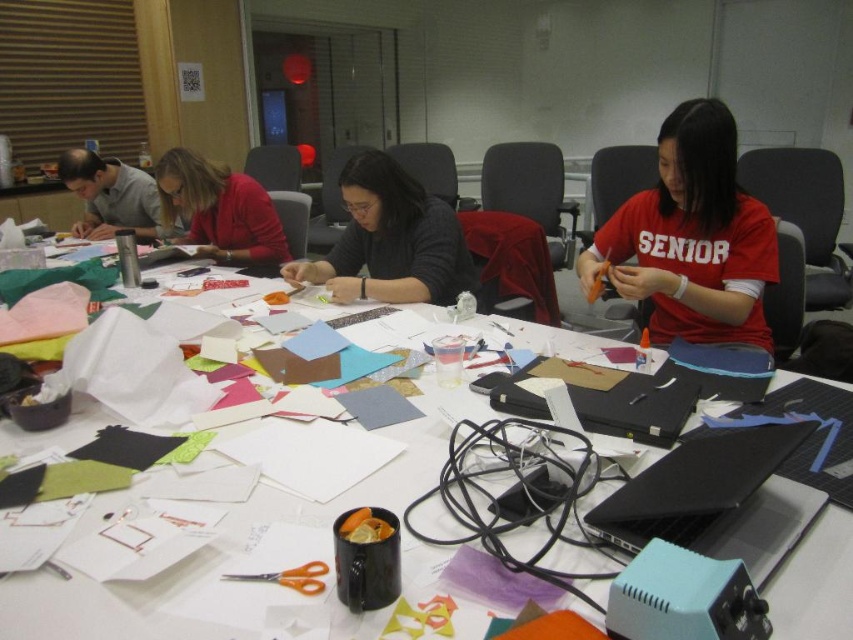
Question: Based on their relative distances, which object is farther from the matte gray shirt at upper left?

Choices:
 (A) matte red sweater at upper left
 (B) matte black sweater at center
 (C) white paper at center

Answer: (C)

Question: Considering the relative positions of black plastic laptop at lower right and matte gray shirt at upper left in the image provided, where is black plastic laptop at lower right located with respect to matte gray shirt at upper left?

Choices:
 (A) right
 (B) left

Answer: (A)

Question: Which is nearer to the white paper at center?

Choices:
 (A) black plastic laptop at lower right
 (B) matte gray shirt at upper left
 (C) matte black sweater at center
 (D) matte red sweater at upper left

Answer: (A)

Question: Is white paper at center smaller than matte gray shirt at upper left?

Choices:
 (A) no
 (B) yes

Answer: (B)

Question: Does red matte shirt at center have a greater width compared to matte gray shirt at upper left?

Choices:
 (A) no
 (B) yes

Answer: (B)

Question: Among these objects, which one is farthest from the camera?

Choices:
 (A) matte gray shirt at upper left
 (B) white paper at center
 (C) matte red sweater at upper left

Answer: (A)